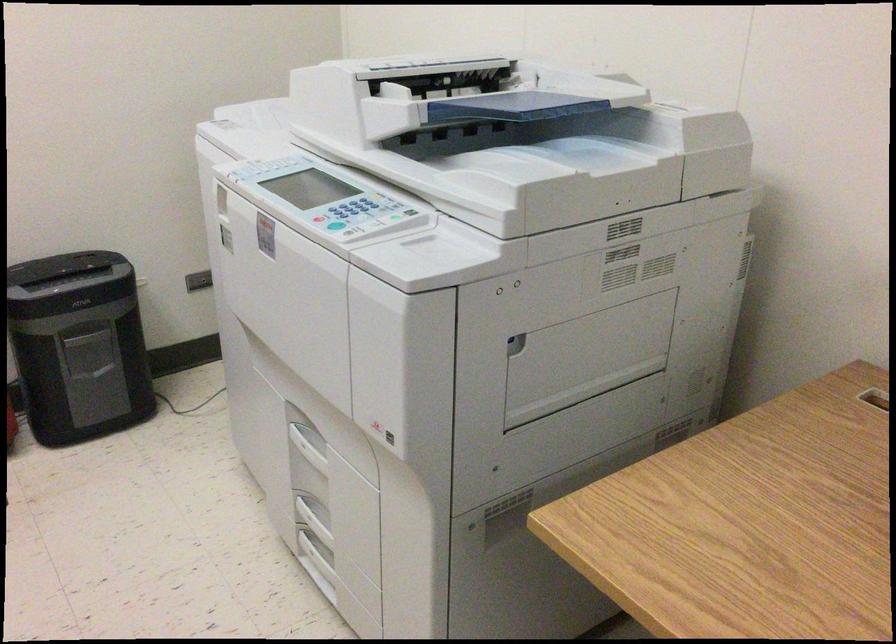
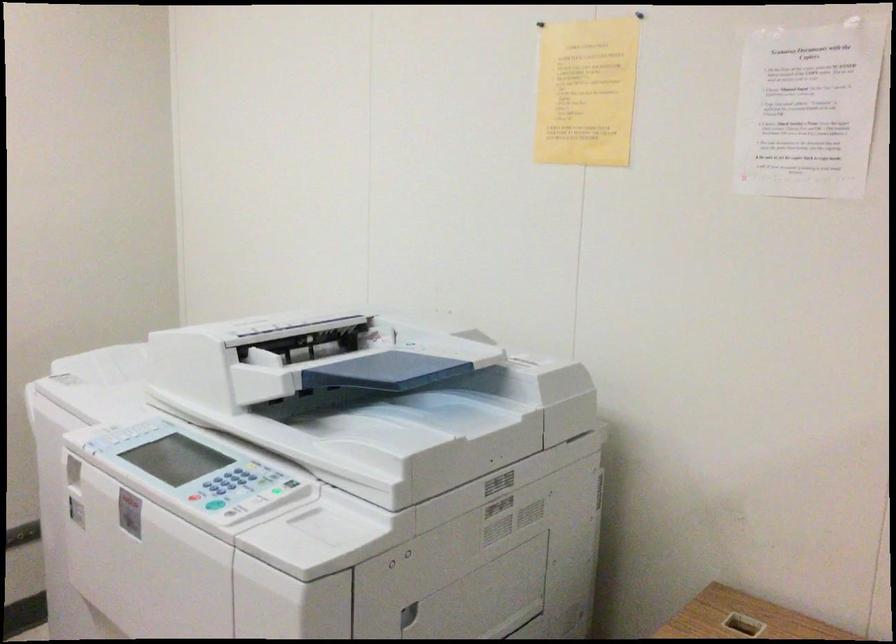
Which direction would the cameraman need to move to produce the second image?

The cameraman moved toward left, backward.